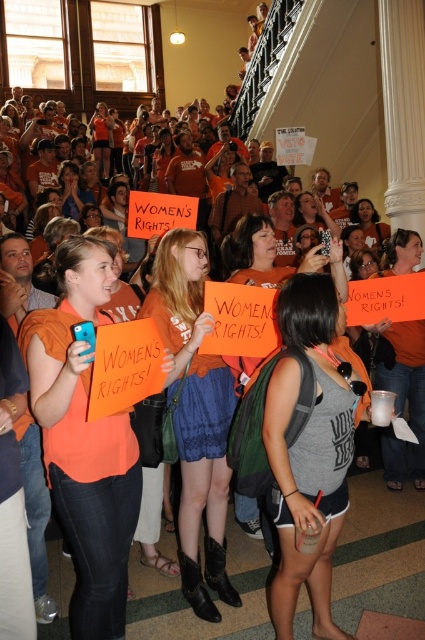
Image resolution: width=425 pixels, height=640 pixels. What are the coordinates of `gray fabric backpack at center` in the screenshot? It's located at pos(272,257).

Can you confirm if gray fabric backpack at center is thinner than matte orange shirt at upper center?

Incorrect, gray fabric backpack at center's width is not less than matte orange shirt at upper center's.

Between point (246, 276) and point (362, 209), which one is positioned behind?

Positioned behind is point (362, 209).

This screenshot has width=425, height=640. Find the location of `gray fabric backpack at center`. gray fabric backpack at center is located at coordinates (272, 257).

Is orange matte sign at center shorter than gray fabric backpack at center?

No, orange matte sign at center is not shorter than gray fabric backpack at center.

Based on the photo, how far apart are orange matte sign at center and gray fabric backpack at center?

orange matte sign at center and gray fabric backpack at center are 2.45 meters apart.

Who is more forward, (402, 381) or (254, 531)?

Point (254, 531)

What are the coordinates of `orange matte sign at center` in the screenshot? It's located at (405, 403).

Describe the element at coordinates (405, 403) in the screenshot. This screenshot has width=425, height=640. I see `orange matte sign at center` at that location.

Is point (407, 257) closer to camera compared to point (374, 211)?

Yes, it is in front of point (374, 211).

Image resolution: width=425 pixels, height=640 pixels. Identify the location of orange matte sign at center. (405, 403).